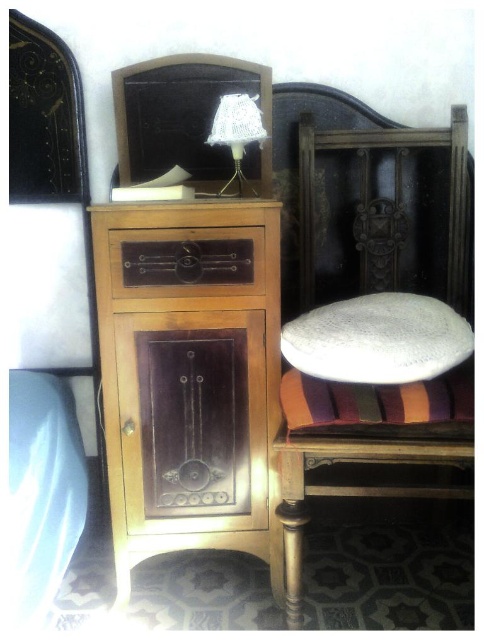
Question: Does wooden cabinet at center come in front of black leather headboard at upper center?

Choices:
 (A) yes
 (B) no

Answer: (A)

Question: Is the position of black leather headboard at upper center less distant than that of wooden drawer at center?

Choices:
 (A) no
 (B) yes

Answer: (A)

Question: Does wooden cabinet at center have a lesser width compared to wooden drawer at center?

Choices:
 (A) no
 (B) yes

Answer: (A)

Question: Which point is closer to the camera?

Choices:
 (A) (356, 416)
 (B) (298, 522)
 (C) (229, 77)

Answer: (A)

Question: Considering the real-world distances, which object is closest to the wooden cabinet at center?

Choices:
 (A) white fabric cushion at center
 (B) black leather headboard at upper center
 (C) white lace lampshade at upper center

Answer: (C)

Question: Which of the following is the closest to the observer?

Choices:
 (A) white lace lampshade at upper center
 (B) wooden drawer at center

Answer: (B)